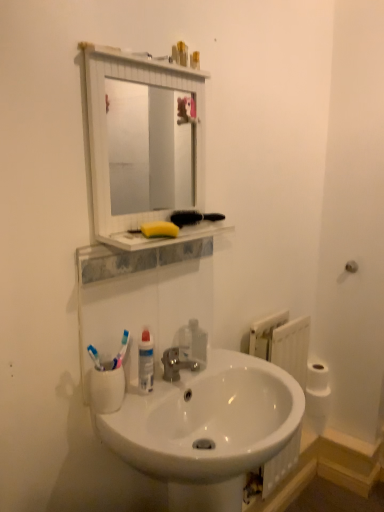
You are a GUI agent. You are given a task and a screenshot of the screen. Output one action in this format:
    pyautogui.click(x=<x>, y=<y>)
    Task: Click on the free location to the right of silver metallic faucet at center
    This screenshot has width=384, height=512.
    Given the screenshot: What is the action you would take?
    pyautogui.click(x=218, y=367)